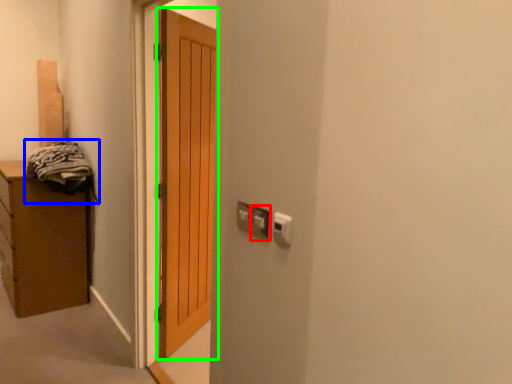
Question: Estimate the real-world distances between objects in this image. Which object is closer to electric outlet (highlighted by a red box), laundry (highlighted by a blue box) or door (highlighted by a green box)?

Choices:
 (A) laundry
 (B) door

Answer: (B)